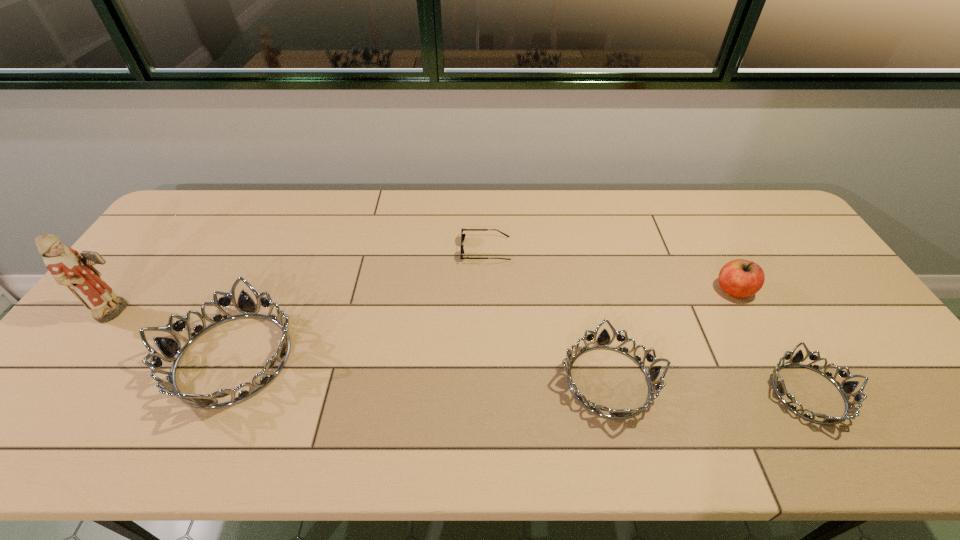
Image resolution: width=960 pixels, height=540 pixels. What are the coordinates of `vacant space located 0.280m on the front-facing side of the farthest object` in the screenshot? It's located at (372, 249).

Find the location of a particular element. vacant region located 0.340m on the back of the apple is located at coordinates pos(689,208).

At what (x,y) coordinates should I click in order to perform the action: click on object that is at the left edge. Please return your answer as a coordinate pair (x, y). This screenshot has width=960, height=540. Looking at the image, I should click on (67, 266).

Find the location of a particular element. Image resolution: width=960 pixels, height=540 pixels. object located in the right edge section of the desktop is located at coordinates (846, 387).

The width and height of the screenshot is (960, 540). I want to click on object present at the near right corner, so click(x=846, y=387).

This screenshot has width=960, height=540. Identify the location of free region at the far edge of the desktop. (713, 197).

In the image, there is a desktop. What are the coordinates of `vacant space at the near edge` in the screenshot? It's located at (195, 383).

The image size is (960, 540). What are the coordinates of `blank area at the right edge` in the screenshot? It's located at (816, 289).

Identify the location of free space at the far left corner of the desktop. This screenshot has width=960, height=540. (211, 198).

This screenshot has height=540, width=960. What are the coordinates of `vacant space at the far right corner` in the screenshot? It's located at (773, 212).